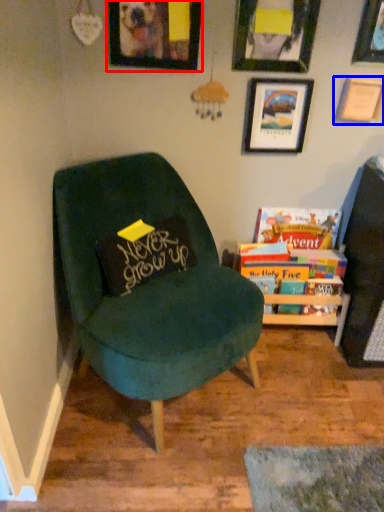
Question: Which point is closer to the camera, picture frame (highlighted by a red box) or picture frame (highlighted by a blue box)?

Choices:
 (A) picture frame
 (B) picture frame

Answer: (A)